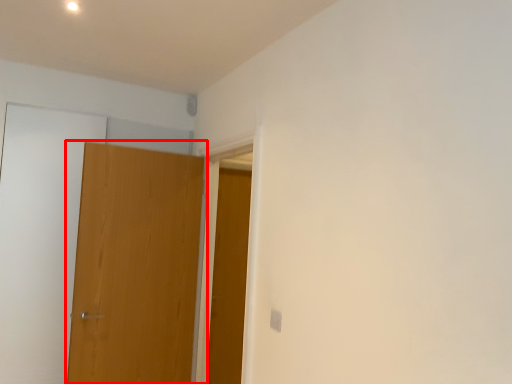
Question: Observing the image, what is the correct spatial positioning of door (annotated by the red box) in reference to door?

Choices:
 (A) left
 (B) right

Answer: (A)